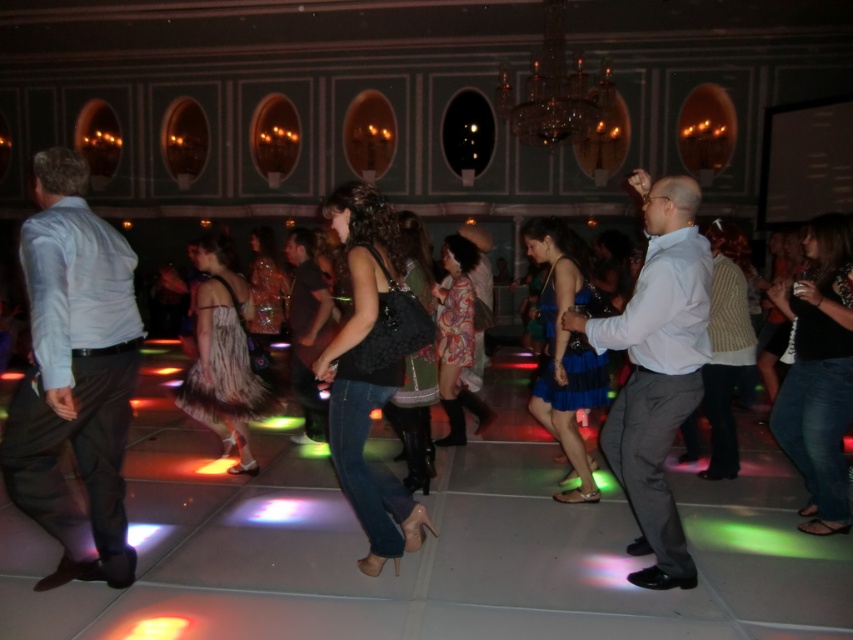
Question: Which of the following is the closest to the observer?

Choices:
 (A) (297, 440)
 (B) (67, 291)
 (C) (686, 214)

Answer: (B)

Question: Is light gray fabric shirt at center positioned in front of dark brown leather jacket at center?

Choices:
 (A) no
 (B) yes

Answer: (B)

Question: Can you confirm if light blue shirt at left is wider than light gray fabric shirt at center?

Choices:
 (A) yes
 (B) no

Answer: (B)

Question: Does light blue shirt at left appear on the right side of dark brown leather jacket at center?

Choices:
 (A) no
 (B) yes

Answer: (A)

Question: Which point is closer to the camera?

Choices:
 (A) (646, 209)
 (B) (132, 264)

Answer: (B)

Question: Among these points, which one is farthest from the camera?

Choices:
 (A) (648, 356)
 (B) (119, 312)

Answer: (A)